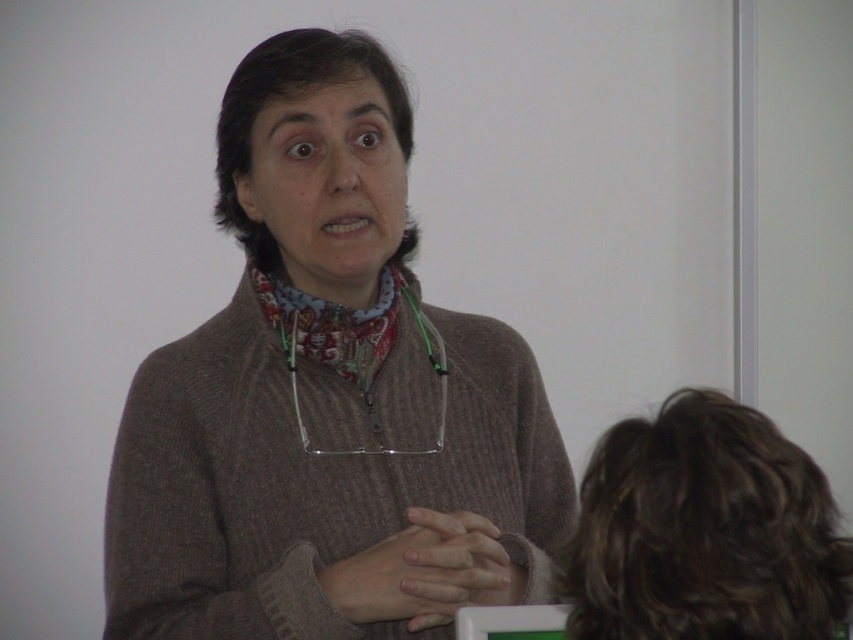
You are designing a portrait of the person in the image. The client wants to ensure that the dark brown hair at lower right and the printed fabric neckband at center are proportionally accurate. Based on the description, which object should be drawn wider in the portrait?

The dark brown hair at lower right should be drawn wider than the printed fabric neckband at center because its width is larger according to the description.

You are a photographer trying to capture a closeup of the glasses hanging from the cord around the speaker. You notice two points marked in the image at coordinates point (390, 198) and point (373, 260). Which point should you focus on to ensure the glasses are in sharp focus?

Point (390, 198) is further to the camera than point (373, 260), so focusing on point (390, 198) will ensure the glasses are in sharp focus.

You are a photographer setting up for a portrait session. You need to ensure that the dark brown hair at lower right and the printed fabric neckband at center are both visible in the frame. Based on their positions, which object should you adjust your camera angle to focus on first to ensure both are in the shot?

The printed fabric neckband at center is at the center, so adjusting the camera angle to focus on it first will help ensure the dark brown hair at lower right, which is on its right side, stays in the frame.